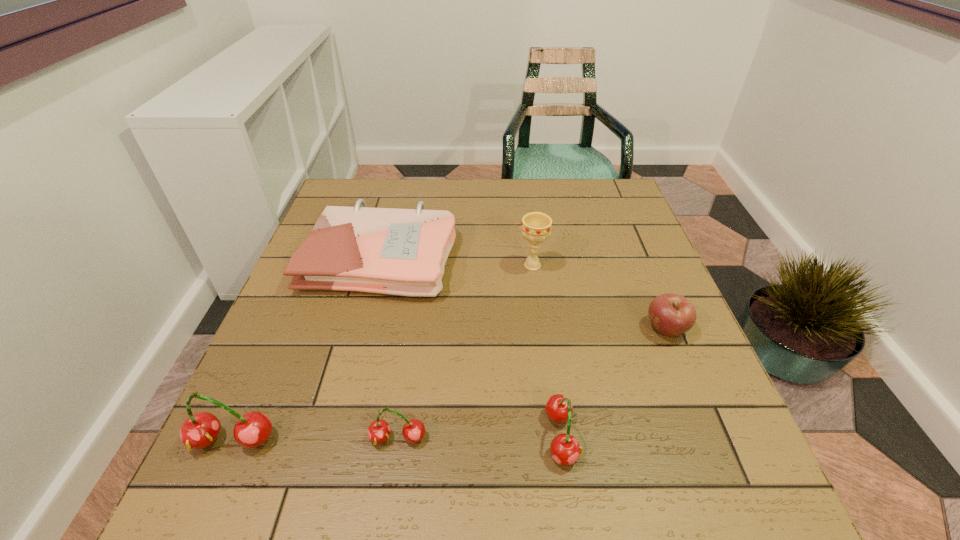
Identify the location of free space that satisfies the following two spatial constraints: 1. on the side of the third farthest object with the unique marking; 2. with stems pointing upwards on the leftmost cherry. (712, 441).

Identify the location of free space that satisfies the following two spatial constraints: 1. on the side of the rightmost object with the unique marking; 2. with stems pointing upwards on the tallest cherry. (712, 441).